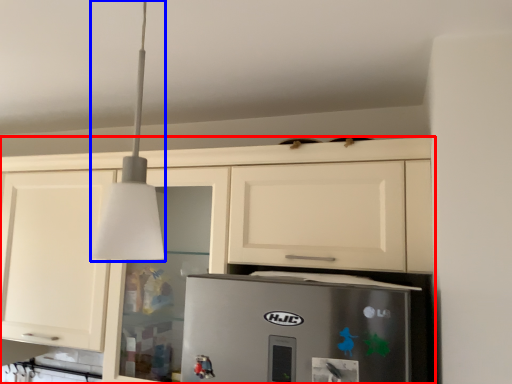
Question: Which of the following is the farthest to the observer, cabinetry (highlighted by a red box) or light fixture (highlighted by a blue box)?

Choices:
 (A) cabinetry
 (B) light fixture

Answer: (A)